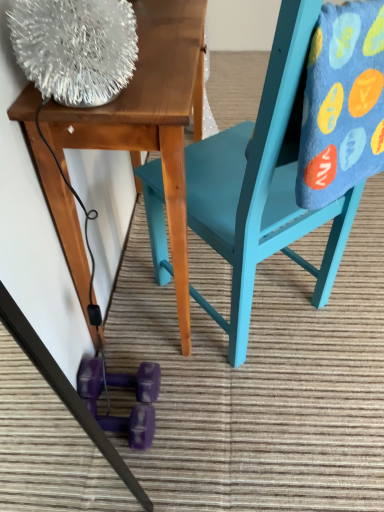
You are a GUI agent. You are given a task and a screenshot of the screen. Output one action in this format:
    pyautogui.click(x=<x>, y=<y>)
    Task: Click on the vacant space behind purple rubber dumbbell at lower center
    This screenshot has height=512, width=384.
    Given the screenshot: What is the action you would take?
    pyautogui.click(x=135, y=336)